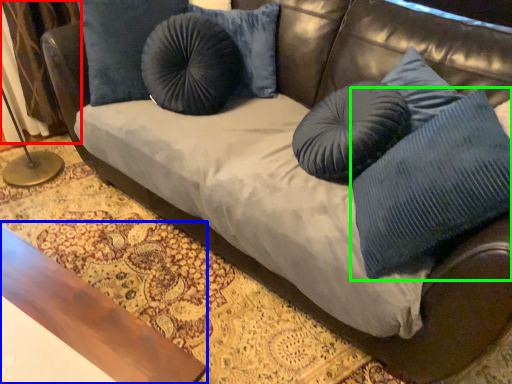
Question: Which is farther away from curtain (highlighted by a red box)? table (highlighted by a blue box) or pillow (highlighted by a green box)?

Choices:
 (A) table
 (B) pillow

Answer: (B)